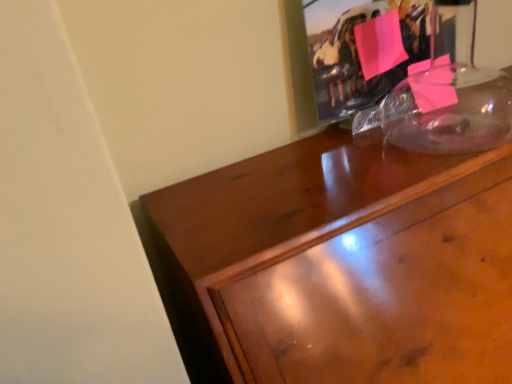
In order to click on free space to the left of pink paper at upper center in this screenshot , I will do `click(289, 158)`.